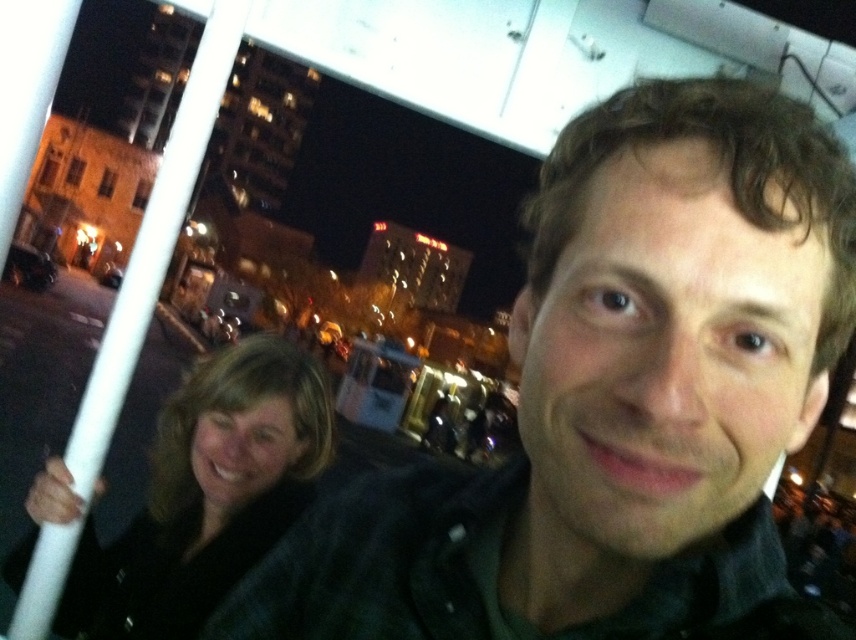
Consider the image. Is dark green shirt at center to the right of dark brown hair at lower left from the viewer's perspective?

Correct, you'll find dark green shirt at center to the right of dark brown hair at lower left.

Who is higher up, dark green shirt at center or dark brown hair at lower left?

dark green shirt at center

What do you see at coordinates (615, 400) in the screenshot? I see `dark green shirt at center` at bounding box center [615, 400].

This screenshot has width=856, height=640. In order to click on dark green shirt at center in this screenshot , I will do `click(615, 400)`.